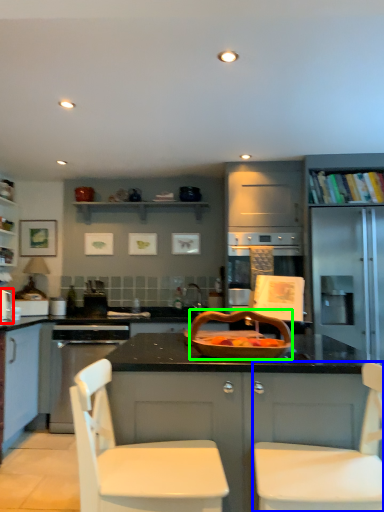
Question: Considering the real-world distances, which object is closest to appliance (highlighted by a red box)? chair (highlighted by a blue box) or basket (highlighted by a green box).

Choices:
 (A) chair
 (B) basket

Answer: (B)